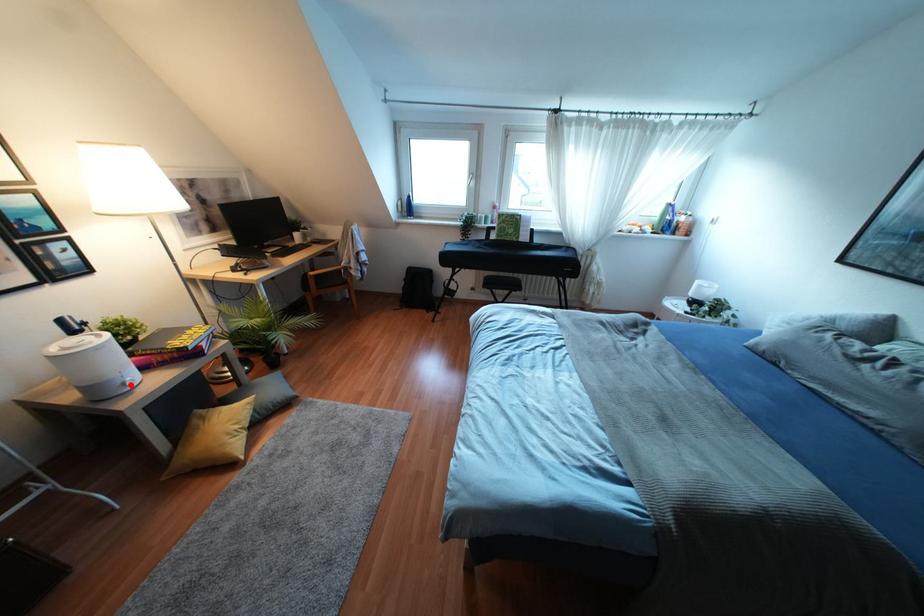
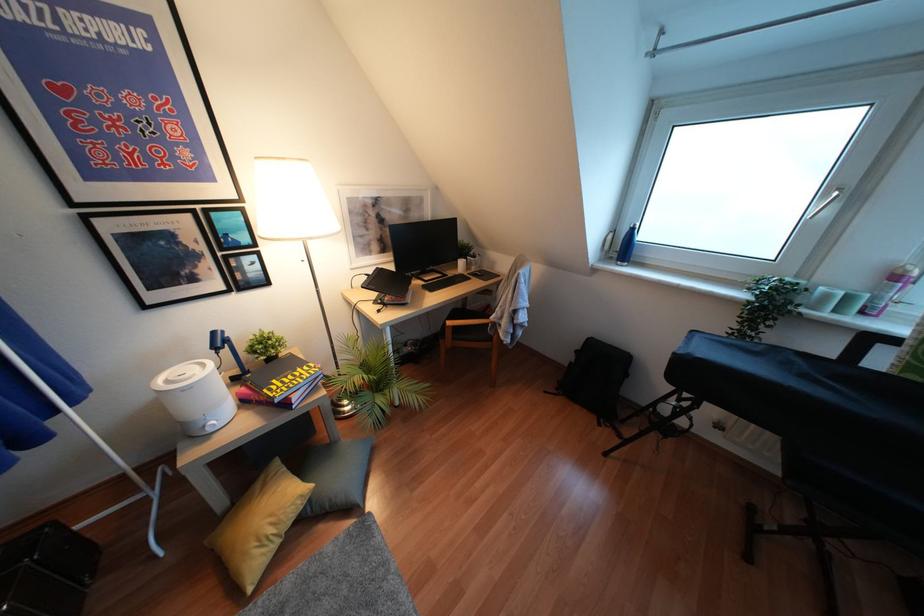
Find the pixel in the second image that matches the highlighted location in the first image.

(210, 430)